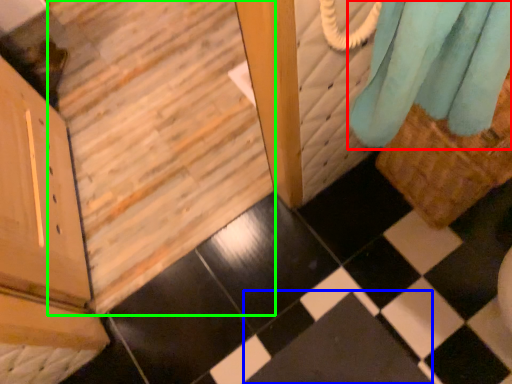
Question: Which is farther away from curtain (highlighted by a red box)? square (highlighted by a blue box) or stairwell (highlighted by a green box)?

Choices:
 (A) square
 (B) stairwell

Answer: (B)